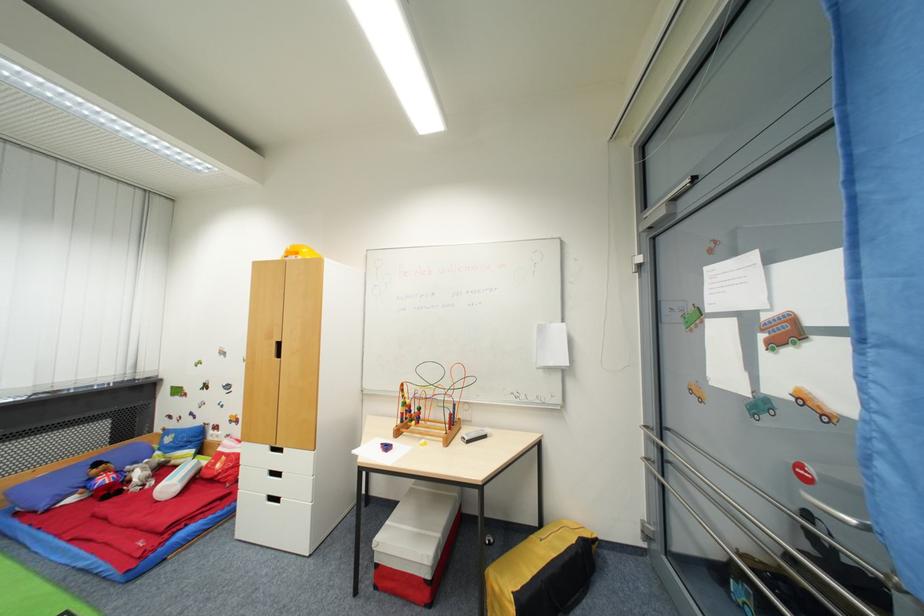
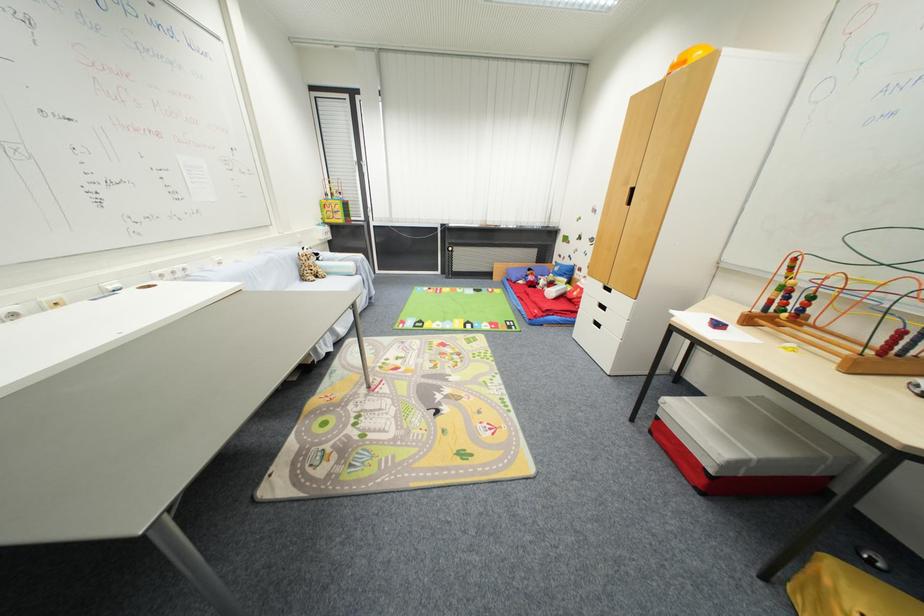
Where in the second image is the point corresponding to point (417, 493) from the first image?

(745, 402)